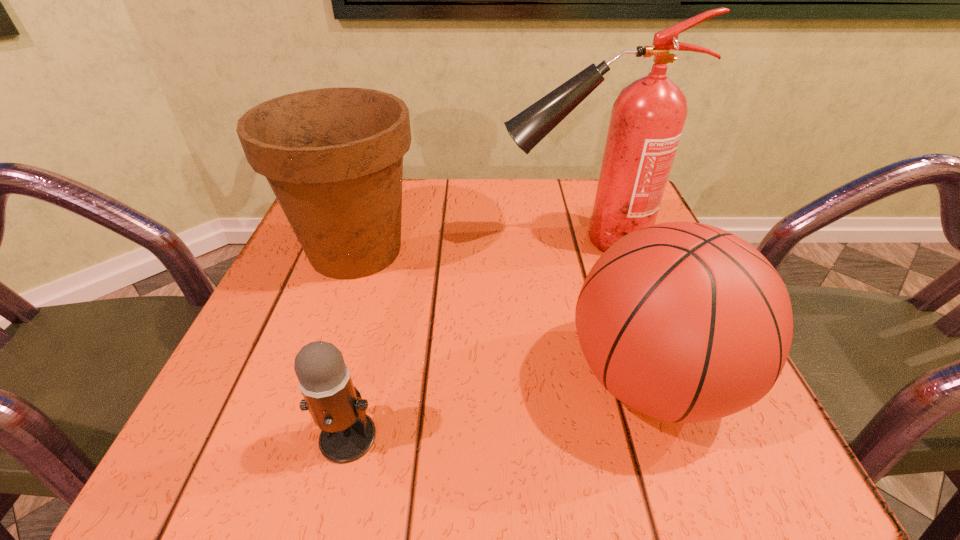
The width and height of the screenshot is (960, 540). Find the location of `fire extinguisher that is positioned at the far edge`. fire extinguisher that is positioned at the far edge is located at coordinates (648, 116).

Where is `flowerpot that is at the far edge`? Image resolution: width=960 pixels, height=540 pixels. flowerpot that is at the far edge is located at coordinates (333, 157).

You are a GUI agent. You are given a task and a screenshot of the screen. Output one action in this format:
    pyautogui.click(x=<x>, y=<y>)
    Task: Click on the basketball that is at the near edge
    This screenshot has height=540, width=960.
    Given the screenshot: What is the action you would take?
    pyautogui.click(x=685, y=322)

Image resolution: width=960 pixels, height=540 pixels. In order to click on microphone located at the near edge in this screenshot , I will do `click(337, 408)`.

Where is `flowerpot that is at the left edge`? flowerpot that is at the left edge is located at coordinates (333, 157).

You are a GUI agent. You are given a task and a screenshot of the screen. Output one action in this format:
    pyautogui.click(x=<x>, y=<y>)
    Task: Click on the microphone that is at the left edge
    The height and width of the screenshot is (540, 960).
    Given the screenshot: What is the action you would take?
    pyautogui.click(x=337, y=408)

You are a GUI agent. You are given a task and a screenshot of the screen. Output one action in this format:
    pyautogui.click(x=<x>, y=<y>)
    Task: Click on the fire extinguisher present at the right edge
    This screenshot has width=960, height=540.
    Given the screenshot: What is the action you would take?
    pyautogui.click(x=648, y=116)

This screenshot has width=960, height=540. I want to click on basketball that is positioned at the right edge, so click(x=685, y=322).

Identify the location of object that is at the far left corner. This screenshot has height=540, width=960. 333,157.

The image size is (960, 540). I want to click on object at the near left corner, so click(337, 408).